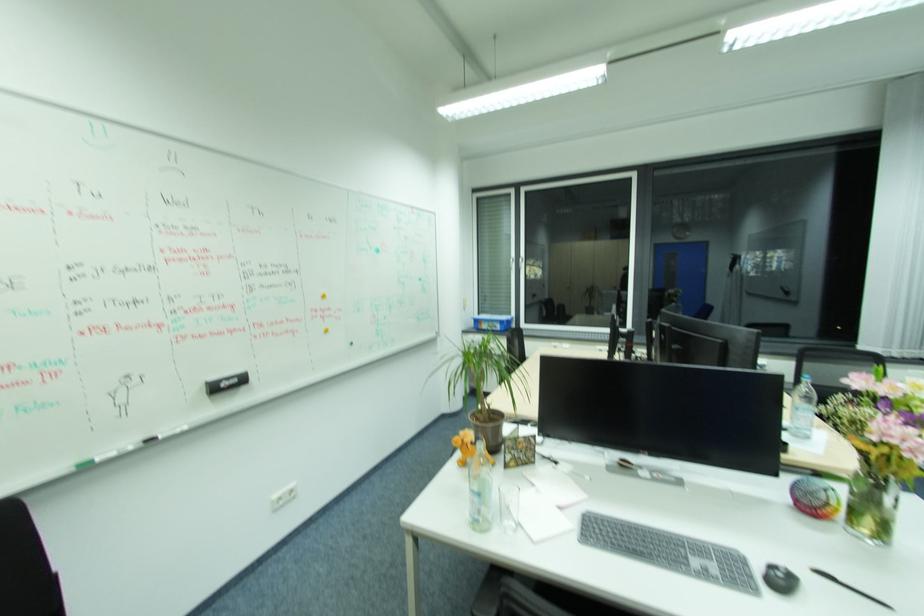
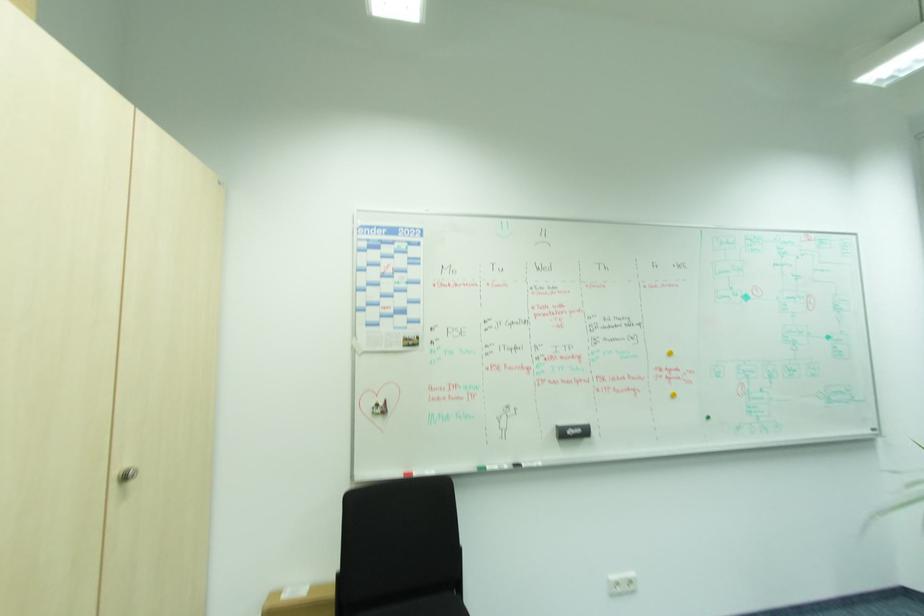
Question: The first image is from the beginning of the video and the second image is from the end. How did the camera likely rotate when shooting the video?

Choices:
 (A) Left
 (B) Right
 (C) Up
 (D) Down

Answer: (A)